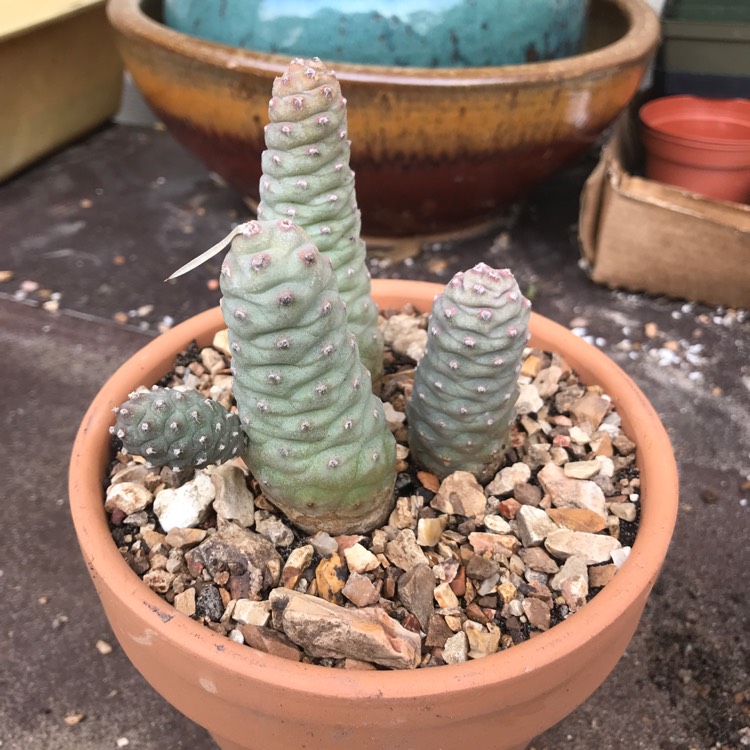
Where is `orange flowerpot`? Image resolution: width=750 pixels, height=750 pixels. orange flowerpot is located at coordinates (421, 696).